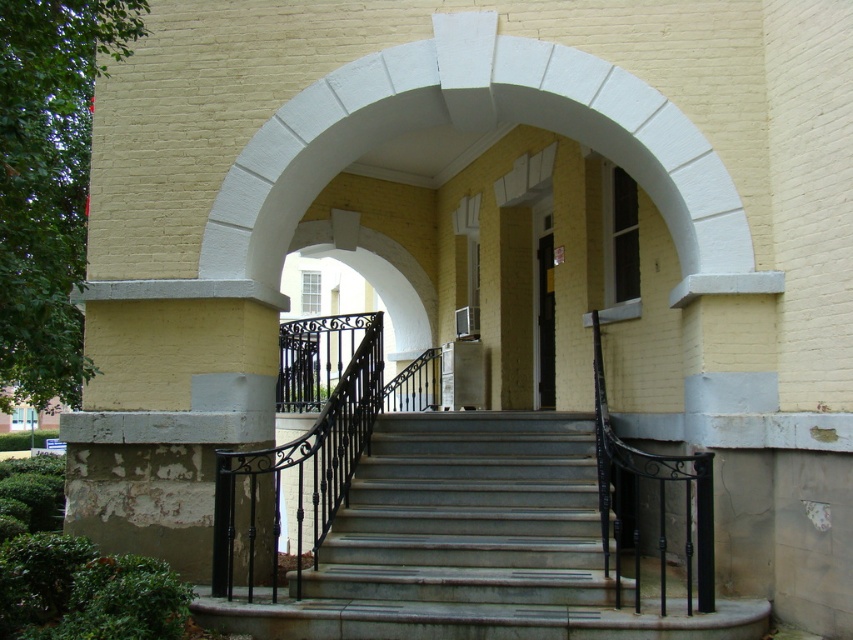
You are standing at the entrance of the building and want to go down the gray concrete stairs at center. Based on their position, can you confirm if the stairs are directly in front of you or to one side?

The gray concrete stairs at center are located at point coordinates, so they are directly in front of you.

You are standing at the bottom of the gray concrete stairs at center and want to enter the building through the black glass door at center. Which direction should you move to reach the door?

Since the gray concrete stairs at center are closer to the viewer than the black glass door at center, you should move upward along the gray concrete stairs at center to reach the black glass door at center.

You are standing at the entrance of the building and want to take a photo of the point at coordinates (529, 509). If your camera has a maximum focus range of 20 feet, will it be able to focus on that point?

The point at coordinates (529, 509) is 22.08 feet away from the camera, which exceeds the maximum focus range of 20 feet. Therefore, the camera will not be able to focus on that point.